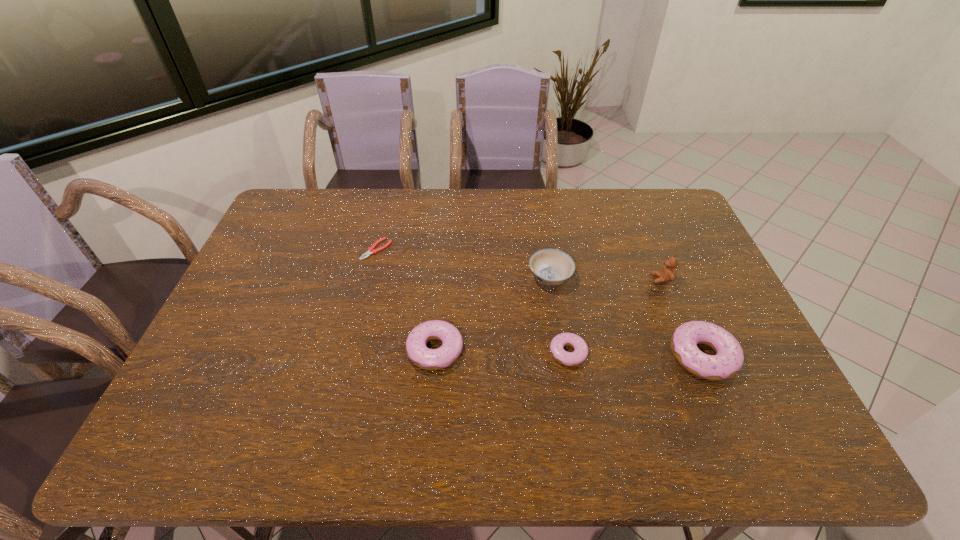
Considering the uniform spacing of doughnuts, where should an additional doughnut be positioned on the left? Please locate a free spot. Please provide its 2D coordinates. Your answer should be formatted as a tuple, i.e. [(x, y)], where the tuple contains the x and y coordinates of a point satisfying the conditions above.

[(303, 347)]